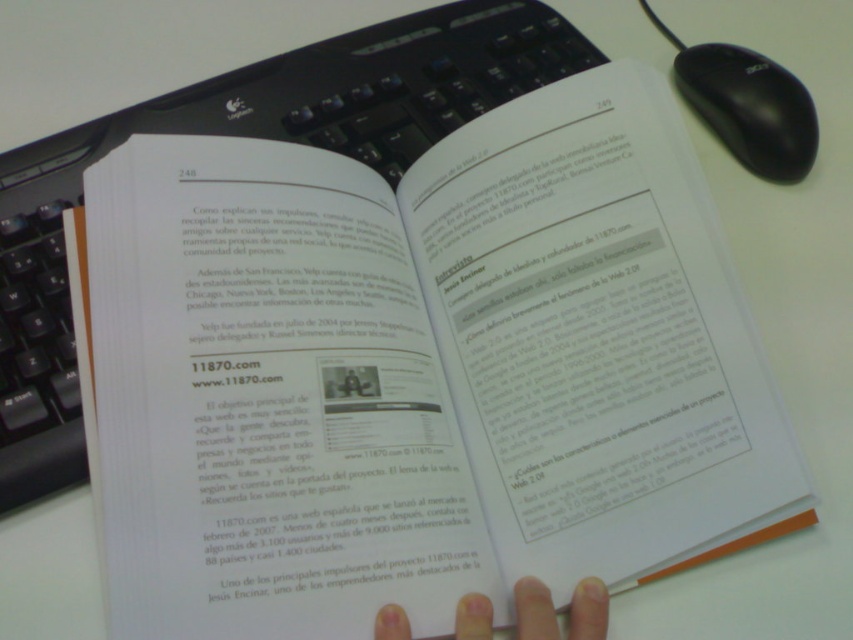
Question: Is black matte mouse at upper right further to the viewer compared to white matte finger at lower center?

Choices:
 (A) no
 (B) yes

Answer: (B)

Question: Does black matte mouse at upper right have a greater width compared to white matte finger at lower center?

Choices:
 (A) yes
 (B) no

Answer: (B)

Question: Does black matte mouse at upper right have a greater width compared to white matte finger at lower center?

Choices:
 (A) yes
 (B) no

Answer: (B)

Question: Which of the following is the farthest from the observer?

Choices:
 (A) (688, 81)
 (B) (581, 618)

Answer: (A)

Question: Which point is closer to the camera?

Choices:
 (A) (757, 106)
 (B) (390, 636)

Answer: (B)